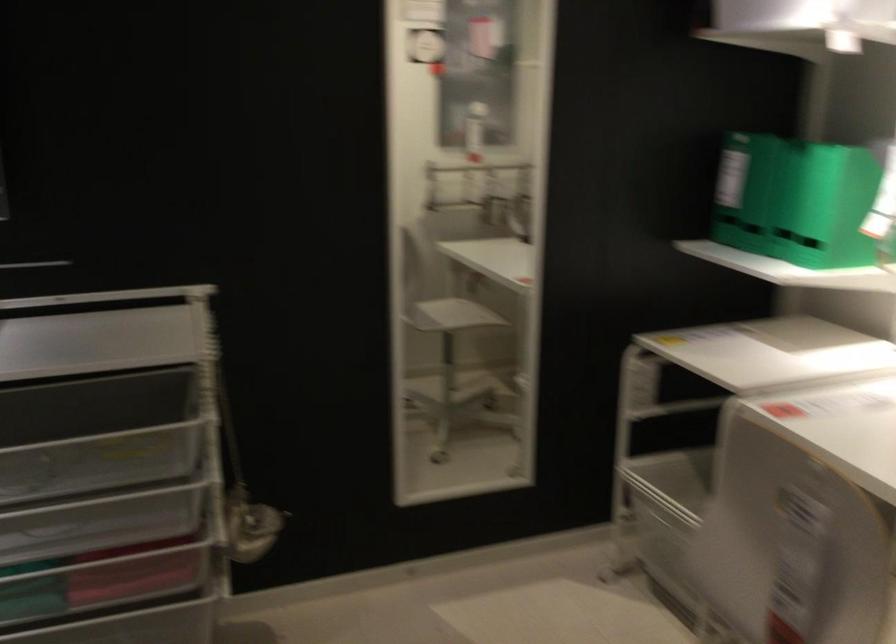
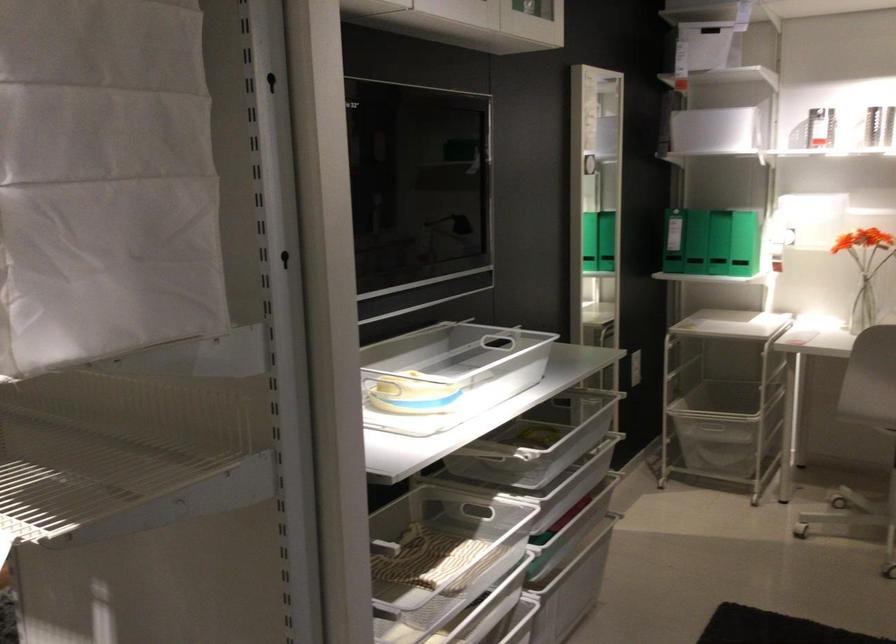
Where in the second image is the point corresponding to [755,543] from the first image?

(869, 379)